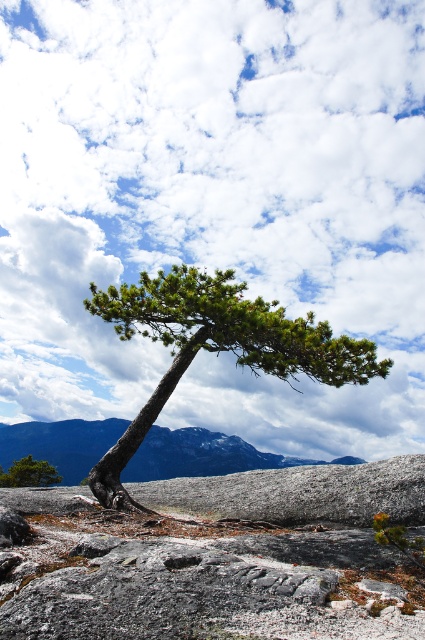
Does green textured pine tree at center have a greater width compared to gray rocky mountain at center?

No.

Does green textured pine tree at center have a larger size compared to gray rocky mountain at center?

Actually, green textured pine tree at center might be smaller than gray rocky mountain at center.

Which is behind, point (161, 332) or point (175, 461)?

The point (175, 461) is behind.

You are a GUI agent. You are given a task and a screenshot of the screen. Output one action in this format:
    pyautogui.click(x=<x>, y=<y>)
    Task: Click on the green textured pine tree at center
    
    Given the screenshot: What is the action you would take?
    pyautogui.click(x=215, y=348)

Consider the image. Who is more distant from viewer, (108,285) or (39,476)?

The point (39,476) is behind.

Is green textured pine tree at center below green matte tree at lower left?

No.

Find the location of a particular element. Image resolution: width=425 pixels, height=640 pixels. green textured pine tree at center is located at coordinates pos(215,348).

Between gray rocky mountain at center and green matte tree at lower left, which one has more height?

gray rocky mountain at center

This screenshot has height=640, width=425. Find the location of `gray rocky mountain at center`. gray rocky mountain at center is located at coordinates (204, 456).

Image resolution: width=425 pixels, height=640 pixels. I want to click on gray rocky mountain at center, so click(204, 456).

The image size is (425, 640). Identify the location of gray rocky mountain at center. (204, 456).